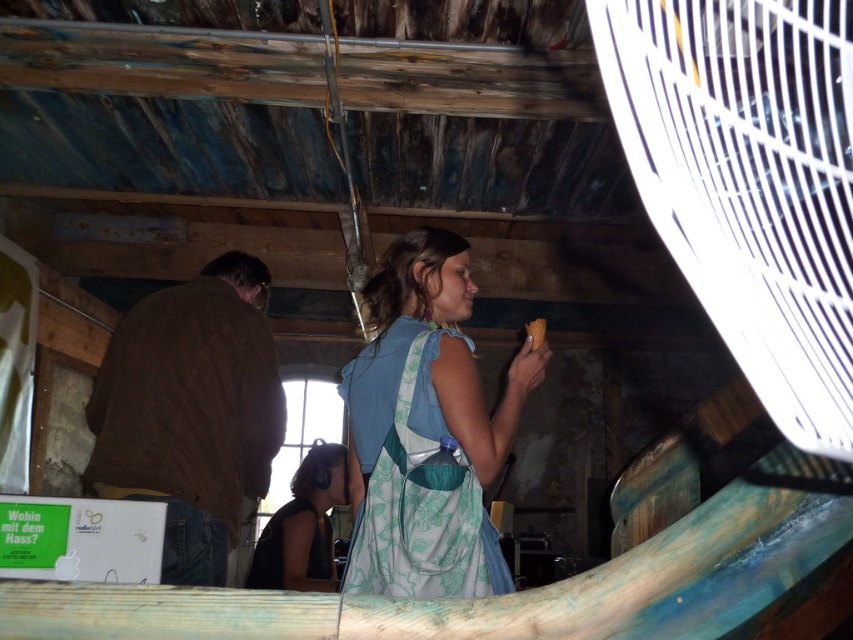
Which is more to the right, white plastic fan at upper right or matte brown bread at center?

white plastic fan at upper right is more to the right.

What do you see at coordinates (749, 180) in the screenshot?
I see `white plastic fan at upper right` at bounding box center [749, 180].

You are a GUI agent. You are given a task and a screenshot of the screen. Output one action in this format:
    pyautogui.click(x=<x>, y=<y>)
    Task: Click on the white plastic fan at upper right
    The image size is (853, 640).
    Given the screenshot: What is the action you would take?
    pyautogui.click(x=749, y=180)

Is white plastic fan at upper right above light blue fabric dress at center?

Indeed, white plastic fan at upper right is positioned over light blue fabric dress at center.

Is point (683, 115) behind point (392, 563)?

That is True.

I want to click on white plastic fan at upper right, so click(x=749, y=180).

Is light blue fabric dress at center in front of brown leather jacket at left?

Yes, light blue fabric dress at center is closer to the viewer.

Is light blue fabric dress at center to the right of brown leather jacket at left from the viewer's perspective?

Indeed, light blue fabric dress at center is positioned on the right side of brown leather jacket at left.

The height and width of the screenshot is (640, 853). What do you see at coordinates (426, 429) in the screenshot? I see `light blue fabric dress at center` at bounding box center [426, 429].

Find the location of a particular element. light blue fabric dress at center is located at coordinates (426, 429).